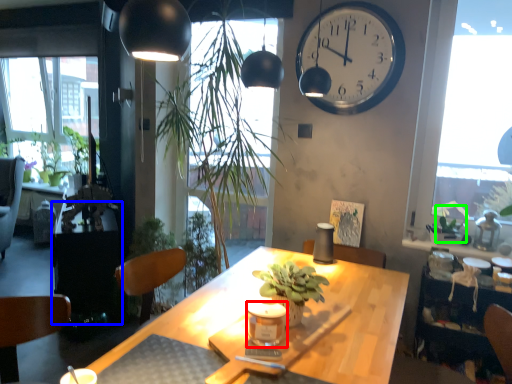
Question: Based on their relative distances, which object is nearer to candle holder (highlighted by a red box)? Choose from table (highlighted by a blue box) and plant (highlighted by a green box).

Choices:
 (A) table
 (B) plant

Answer: (B)